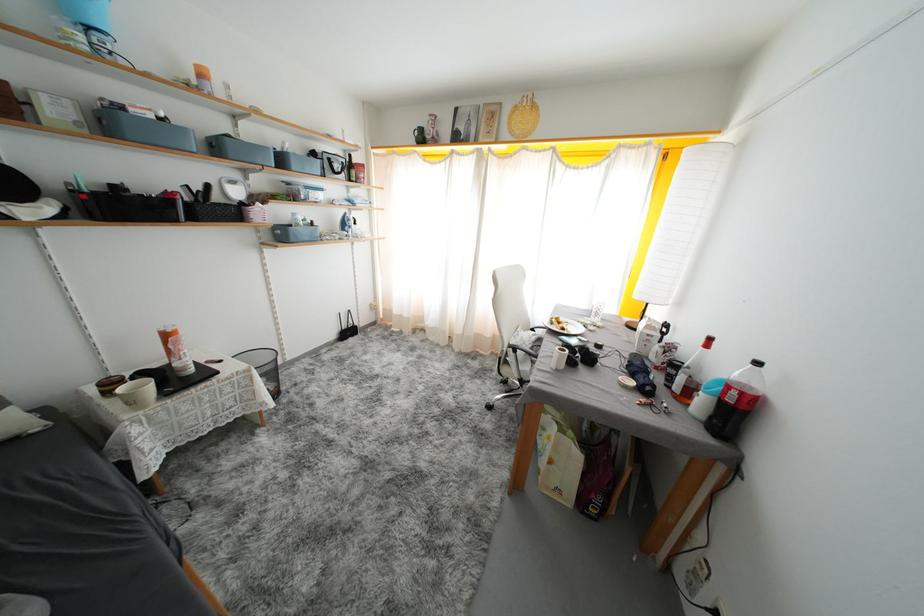
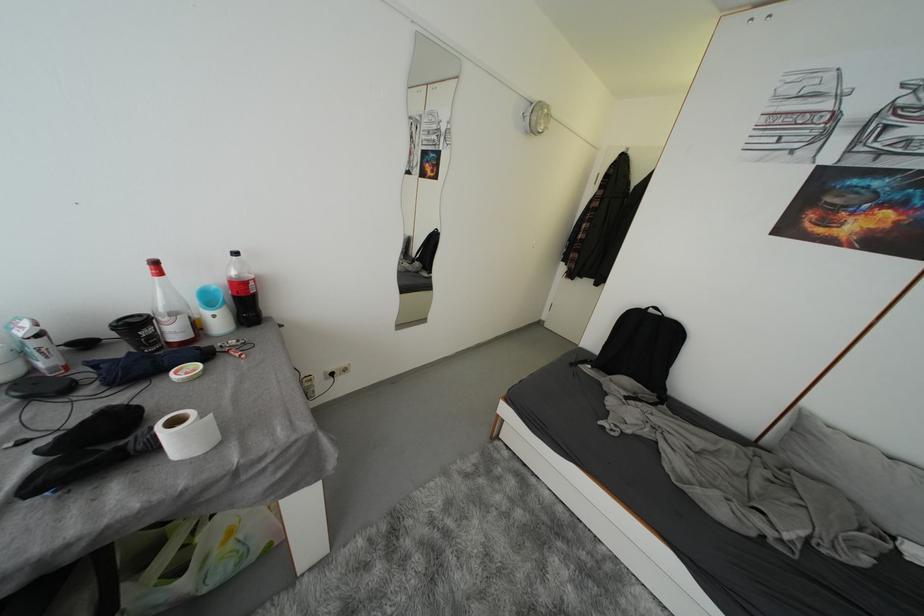
The point at (764, 368) is marked in the first image. Where is the corresponding point in the second image?

(242, 257)